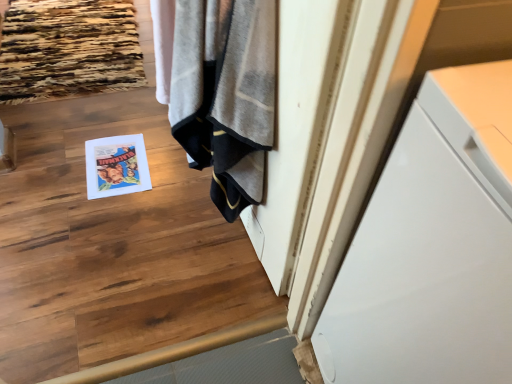
The height and width of the screenshot is (384, 512). I want to click on vacant space situated above matte paper magazine at center (from a real-world perspective), so click(117, 158).